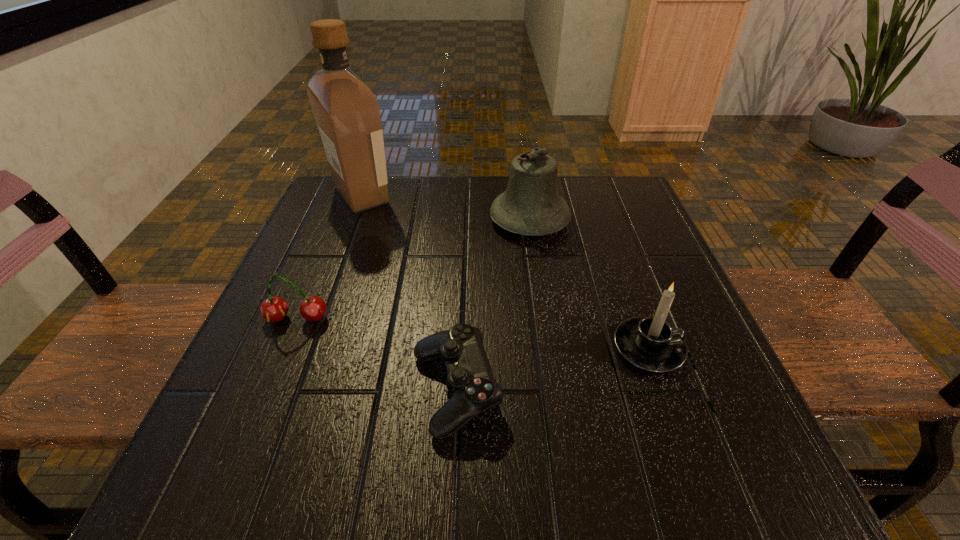
The width and height of the screenshot is (960, 540). Find the location of `empty space between the control and the candle holder`. empty space between the control and the candle holder is located at coordinates (552, 370).

Identify the location of vacant area that lies between the fourth tallest object and the shortest object. (376, 355).

What are the coordinates of `free space between the tallest object and the rightmost object` in the screenshot? It's located at (505, 272).

I want to click on object that stands as the third closest to the cherry, so click(531, 205).

I want to click on object that is the second closest to the cherry, so click(347, 113).

Find the location of a particular element. The width and height of the screenshot is (960, 540). free location that satisfies the following two spatial constraints: 1. on the front-facing side of the bell; 2. on the left side of the tallest object is located at coordinates (352, 219).

In order to click on vacant area that satisfies the following two spatial constraints: 1. on the back side of the bell; 2. on the front-facing side of the tallest object in this screenshot , I will do `click(526, 195)`.

This screenshot has height=540, width=960. I want to click on vacant position in the image that satisfies the following two spatial constraints: 1. on the front-facing side of the tallest object; 2. on the right side of the bell, so click(x=352, y=219).

Where is `vacant area that satisfies the following two spatial constraints: 1. on the front-facing side of the tallest object; 2. with stems pointing upwards on the second shortest object`? The width and height of the screenshot is (960, 540). vacant area that satisfies the following two spatial constraints: 1. on the front-facing side of the tallest object; 2. with stems pointing upwards on the second shortest object is located at coordinates (316, 319).